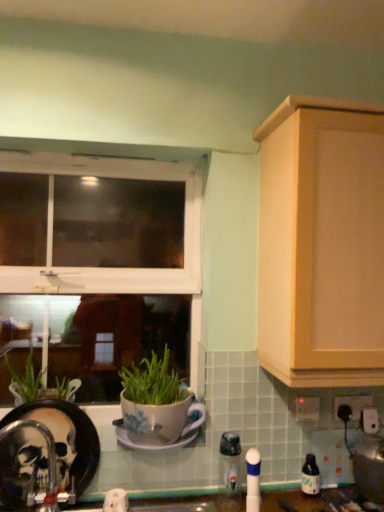
Question: From a real-world perspective, is transparent plastic bottle at lower right beneath translucent plastic soap dispenser at lower center, the 1th appliance from the left?

Choices:
 (A) no
 (B) yes

Answer: (B)

Question: Are transparent plastic bottle at lower right and translucent plastic soap dispenser at lower center, acting as the 2th appliance starting from the right, far apart?

Choices:
 (A) no
 (B) yes

Answer: (A)

Question: Does transparent plastic bottle at lower right appear on the right side of translucent plastic soap dispenser at lower center, the 1th appliance from the left?

Choices:
 (A) yes
 (B) no

Answer: (A)

Question: Does transparent plastic bottle at lower right turn towards translucent plastic soap dispenser at lower center, the 1th appliance from the left?

Choices:
 (A) yes
 (B) no

Answer: (B)

Question: From a real-world perspective, is transparent plastic bottle at lower right over translucent plastic soap dispenser at lower center, the 1th appliance from the left?

Choices:
 (A) no
 (B) yes

Answer: (A)

Question: Is transparent plastic bottle at lower right positioned in front of translucent plastic soap dispenser at lower center, the 1th appliance from the left?

Choices:
 (A) no
 (B) yes

Answer: (A)

Question: Is brushed metal faucet at lower left aimed at light wood cabinet at upper right?

Choices:
 (A) no
 (B) yes

Answer: (A)

Question: Is brushed metal faucet at lower left behind light wood cabinet at upper right?

Choices:
 (A) yes
 (B) no

Answer: (A)

Question: From the image's perspective, is brushed metal faucet at lower left located above light wood cabinet at upper right?

Choices:
 (A) no
 (B) yes

Answer: (A)

Question: Can you confirm if brushed metal faucet at lower left is bigger than light wood cabinet at upper right?

Choices:
 (A) no
 (B) yes

Answer: (A)

Question: Can you confirm if brushed metal faucet at lower left is shorter than light wood cabinet at upper right?

Choices:
 (A) yes
 (B) no

Answer: (A)

Question: Can you confirm if brushed metal faucet at lower left is taller than light wood cabinet at upper right?

Choices:
 (A) yes
 (B) no

Answer: (B)

Question: Is metallic silver toaster at lower right, the 1th appliance when ordered from right to left, wider than white plastic electric outlet at upper right, the first electric outlet when ordered from left to right?

Choices:
 (A) yes
 (B) no

Answer: (A)